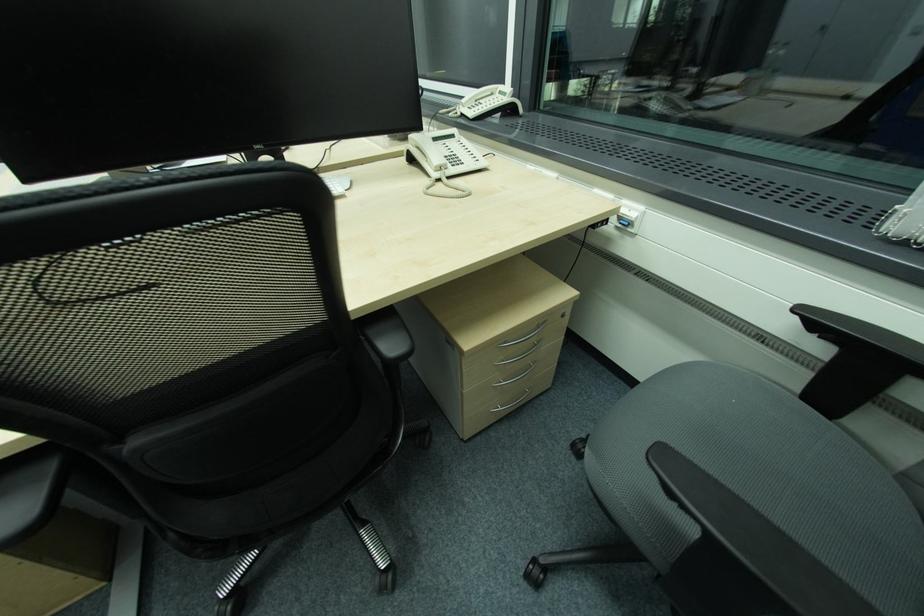
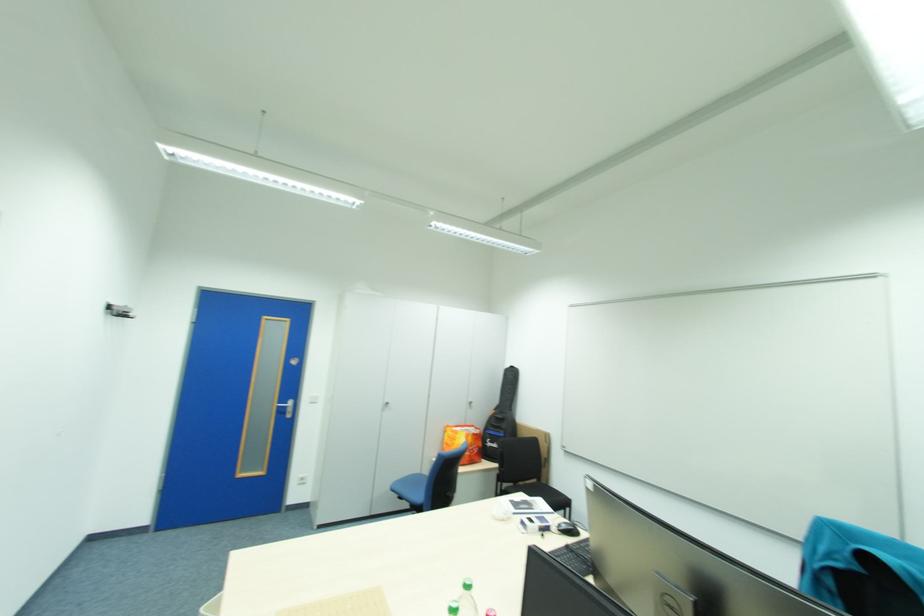
Question: The first image is from the beginning of the video and the second image is from the end. How did the camera likely rotate when shooting the video?

Choices:
 (A) Left
 (B) Right
 (C) Up
 (D) Down

Answer: (A)